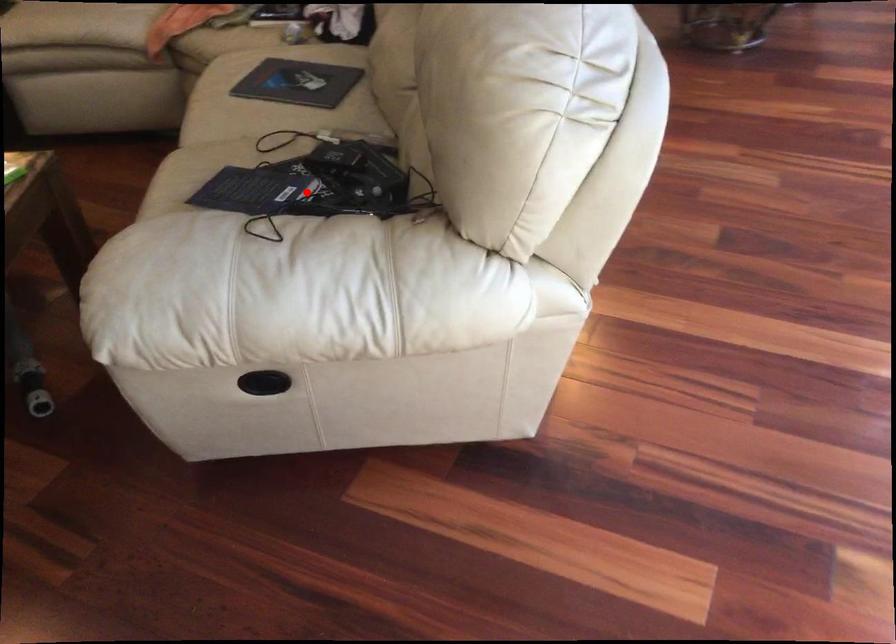
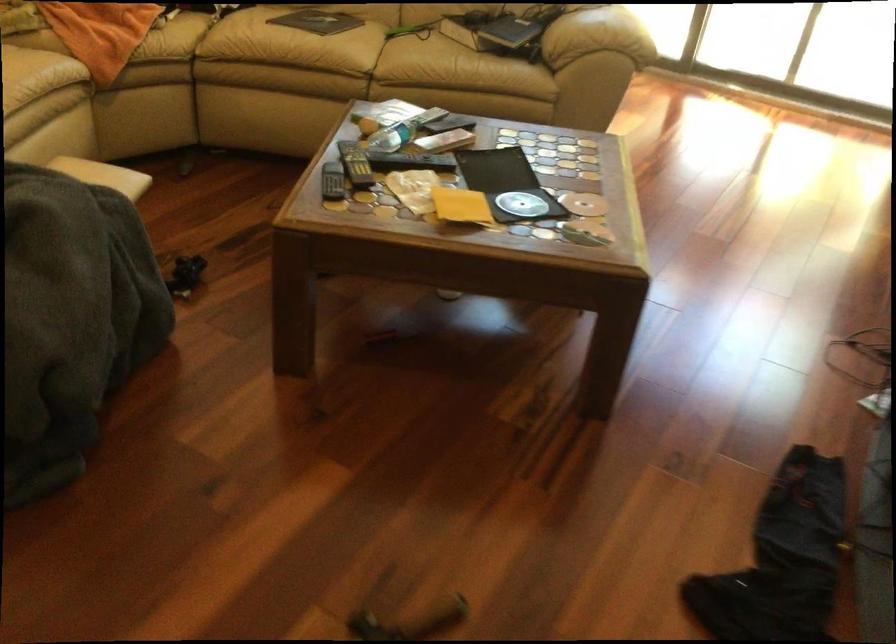
In the second image, find the point that corresponds to the highlighted location in the first image.

(510, 31)